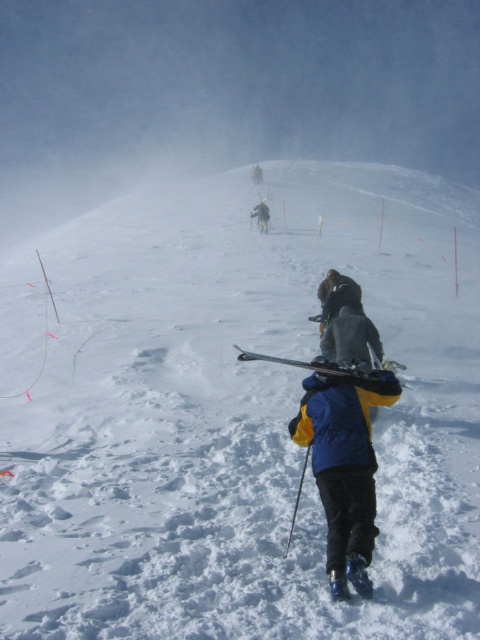
Is shiny metallic ski at center behind dark gray jacket at center?

No.

Is point (307, 369) less distant than point (262, 225)?

Yes.

Find the location of a particular element. shiny metallic ski at center is located at coordinates (305, 364).

Is blue/yellow jacket at center behind dark gray jacket at center?

No, blue/yellow jacket at center is in front of dark gray jacket at center.

Is blue/yellow jacket at center to the right of dark gray jacket at center from the viewer's perspective?

Correct, you'll find blue/yellow jacket at center to the right of dark gray jacket at center.

Is point (368, 474) positioned behind point (264, 211)?

No, it is in front of (264, 211).

Where is `blue/yellow jacket at center`? blue/yellow jacket at center is located at coordinates (345, 467).

Which of these two, blue/yellow jacket at center or shiny metallic ski at center, stands taller?

Standing taller between the two is blue/yellow jacket at center.

Locate an element on the screen. blue/yellow jacket at center is located at coordinates (345, 467).